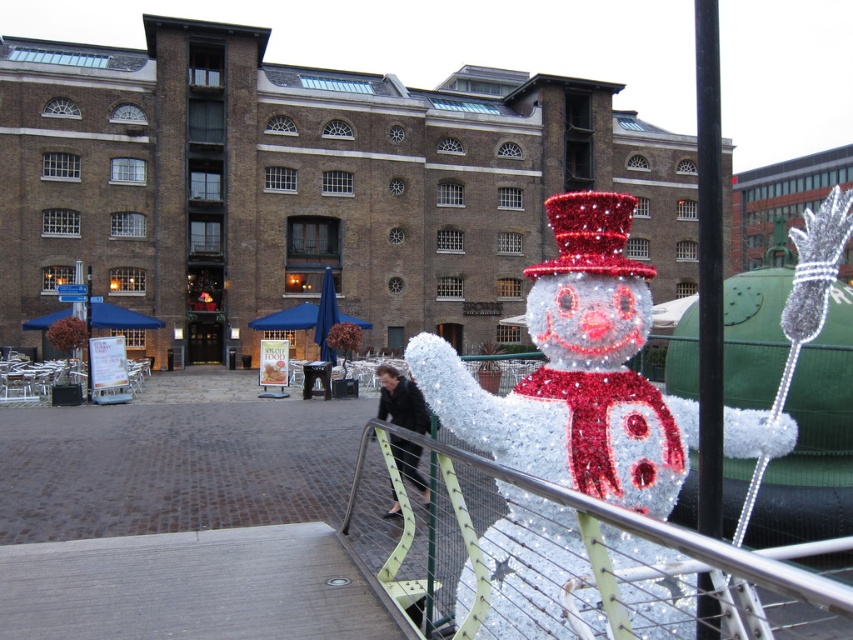
Is black metal pole at right above shiny red sequined hat at center?

Actually, black metal pole at right is below shiny red sequined hat at center.

Is black metal pole at right closer to the viewer compared to shiny red sequined hat at center?

Yes, black metal pole at right is in front of shiny red sequined hat at center.

This screenshot has height=640, width=853. What do you see at coordinates (709, 266) in the screenshot?
I see `black metal pole at right` at bounding box center [709, 266].

Where is `black metal pole at right`? This screenshot has height=640, width=853. black metal pole at right is located at coordinates (709, 266).

Can you confirm if iridescent plastic snowman at center is positioned to the right of shiny red sequined hat at center?

In fact, iridescent plastic snowman at center is to the left of shiny red sequined hat at center.

This screenshot has height=640, width=853. Describe the element at coordinates (576, 372) in the screenshot. I see `iridescent plastic snowman at center` at that location.

At what (x,y) coordinates should I click in order to perform the action: click on iridescent plastic snowman at center. Please return your answer as a coordinate pair (x, y). Looking at the image, I should click on click(x=576, y=372).

Is metallic silver fence at lower right above shiny red sequined hat at center?

Actually, metallic silver fence at lower right is below shiny red sequined hat at center.

Who is lower down, metallic silver fence at lower right or shiny red sequined hat at center?

metallic silver fence at lower right is below.

This screenshot has width=853, height=640. What are the coordinates of `metallic silver fence at lower right` in the screenshot? It's located at (611, 548).